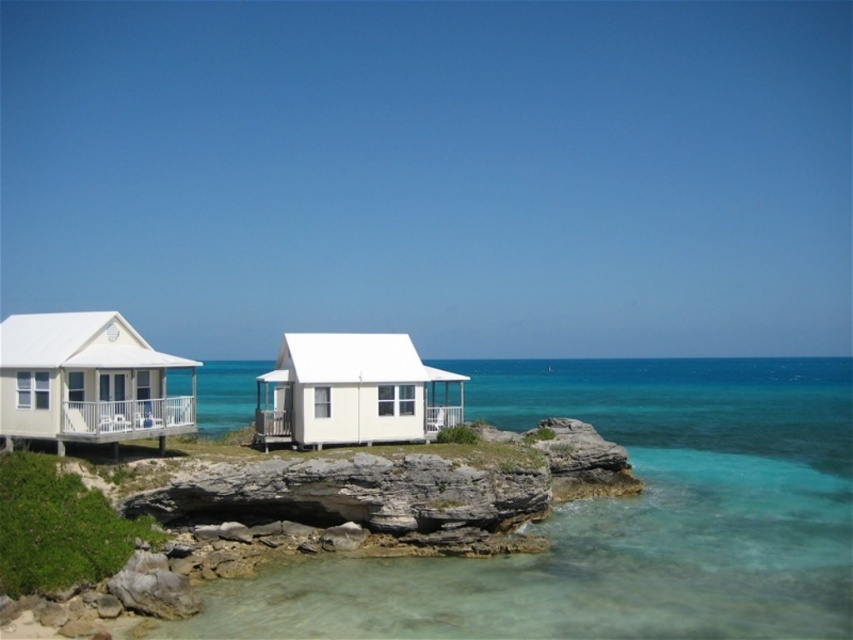
You are a tourist standing at the rocky outcrop looking at the white matte cabin at center and the clear glass water at center. Which object is positioned to the right of the other?

The clear glass water at center is to the right of the white matte cabin at center.

You are a visitor planning to take a photo of both the white matte cabin at left and the white matte cabin at center from a position on the rocky outcrop. Considering their heights, which cabin will appear larger in the photo?

The white matte cabin at left will appear larger in the photo because it is much taller than the white matte cabin at center.